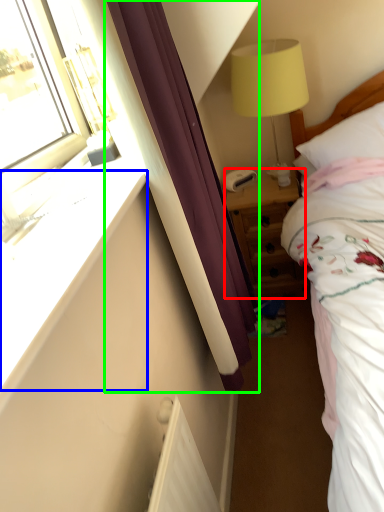
Question: Estimate the real-world distances between objects in this image. Which object is farther from nightstand (highlighted by a red box), window sill (highlighted by a blue box) or curtain (highlighted by a green box)?

Choices:
 (A) window sill
 (B) curtain

Answer: (A)